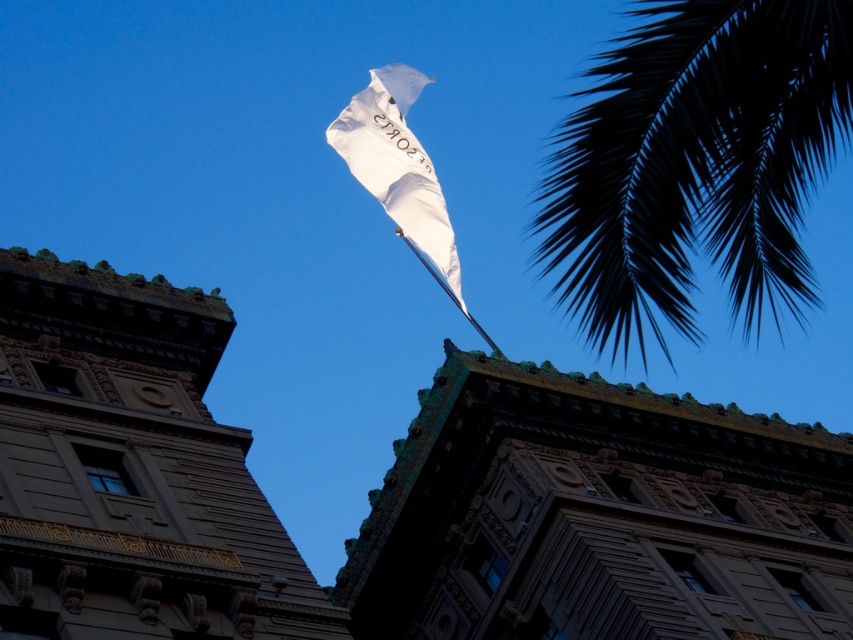
You are an architect analyzing the spatial relationship between the gold textured stone tower at center and the white fabric flag at upper center. Which object appears taller in the image?

The gold textured stone tower at center has a lesser height compared to the white fabric flag at upper center, so the white fabric flag at upper center is taller.